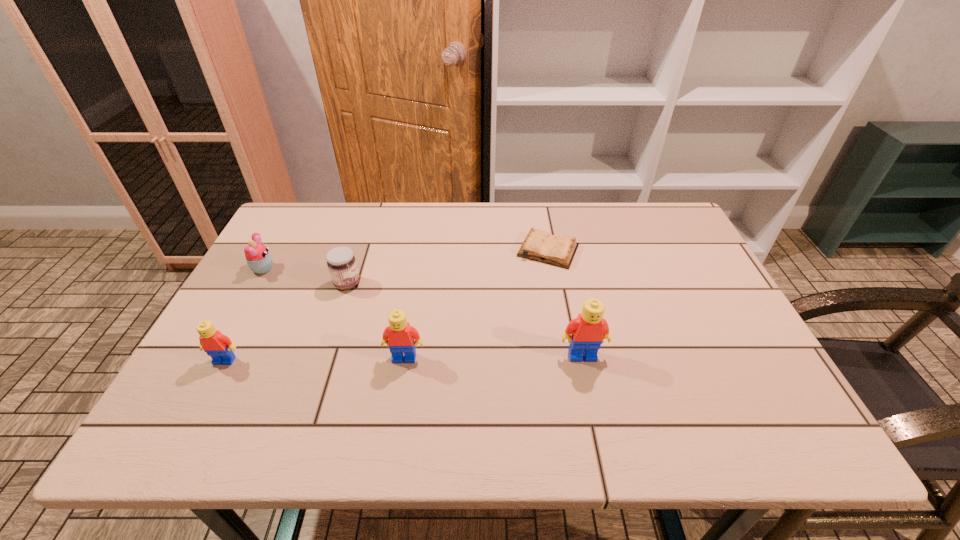
This screenshot has width=960, height=540. Find the location of `vacant space located on the face of the rightmost Lego`. vacant space located on the face of the rightmost Lego is located at coordinates (590, 394).

Image resolution: width=960 pixels, height=540 pixels. What are the coordinates of `free region located 0.290m on the left of the shortest object` in the screenshot? It's located at (419, 251).

I want to click on free space located on the front label of the third object from left to right, so click(x=503, y=284).

The height and width of the screenshot is (540, 960). Find the location of `vacant region located on the face of the cupcake`. vacant region located on the face of the cupcake is located at coordinates (313, 269).

Find the location of `object that is at the far edge`. object that is at the far edge is located at coordinates (559, 250).

The width and height of the screenshot is (960, 540). I want to click on Lego that is at the left edge, so click(217, 345).

I want to click on cupcake that is positioned at the left edge, so click(259, 260).

This screenshot has width=960, height=540. In the image, there is a desktop. In order to click on vacant space at the far edge in this screenshot , I will do `click(563, 224)`.

This screenshot has height=540, width=960. Find the location of `vacant space at the near edge of the desktop`. vacant space at the near edge of the desktop is located at coordinates (295, 398).

Where is `vacant space at the right edge of the desktop`? vacant space at the right edge of the desktop is located at coordinates (714, 318).